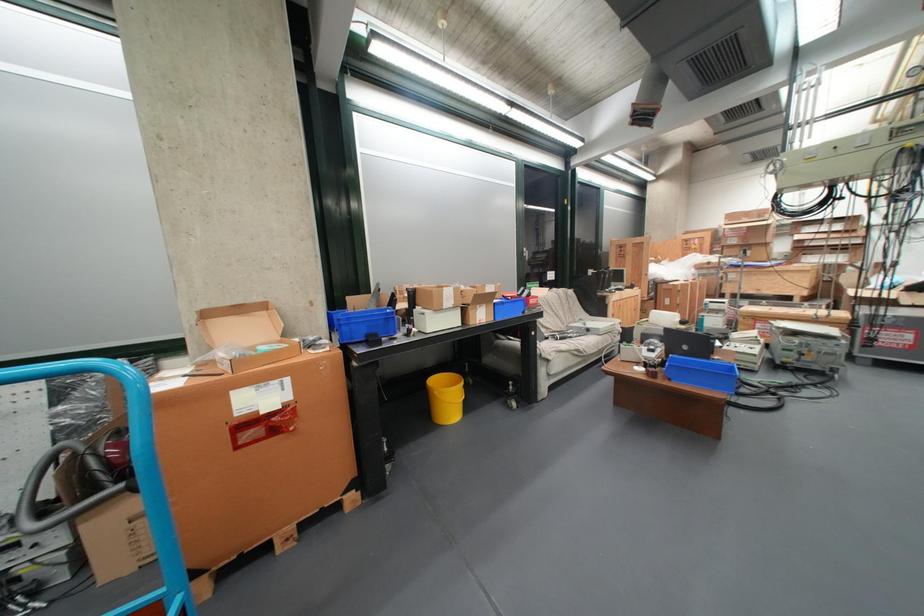
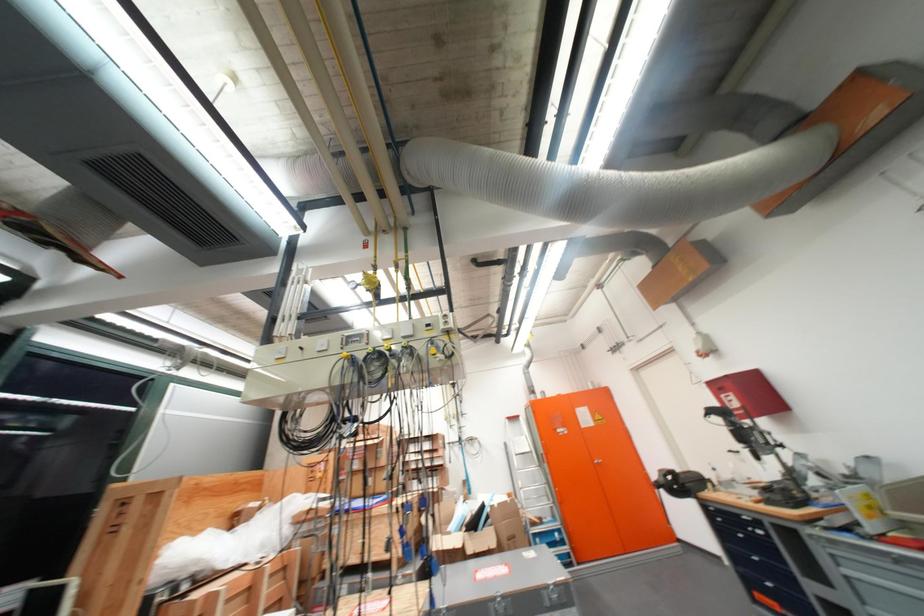
Question: I am providing you with two images of the same scene from different viewpoints. Which of the following objects are not visible in image2?

Choices:
 (A) blue drawer handle
 (B) cabinet door handle
 (C) yellow control knob
 (D) none of these

Answer: (D)